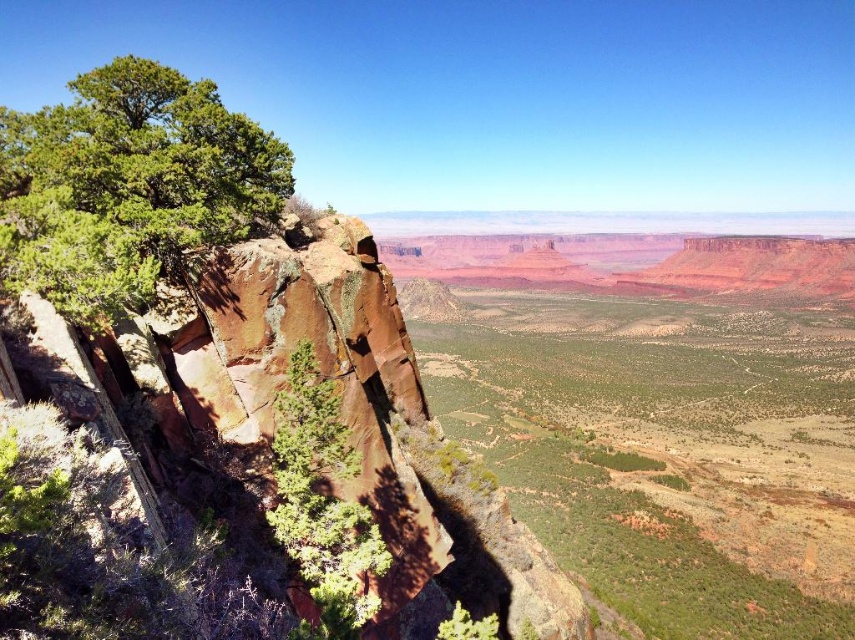
Based on the photo, you are standing at the point marked as point (130, 188) and want to find the green rough bark tree at left. Which direction should you look to see it?

The green rough bark tree at left is located at point (130, 188), so you are already at the location of the green rough bark tree at left.